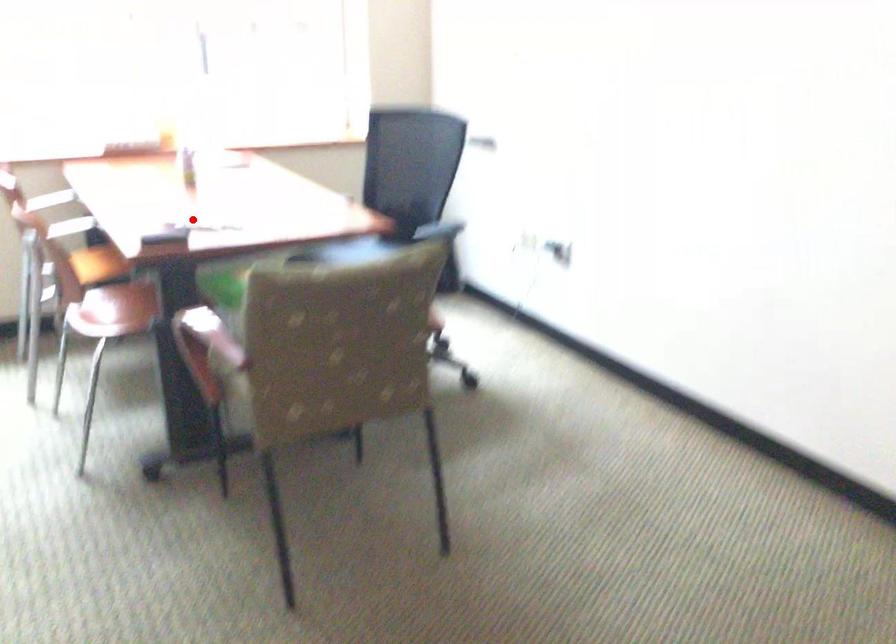
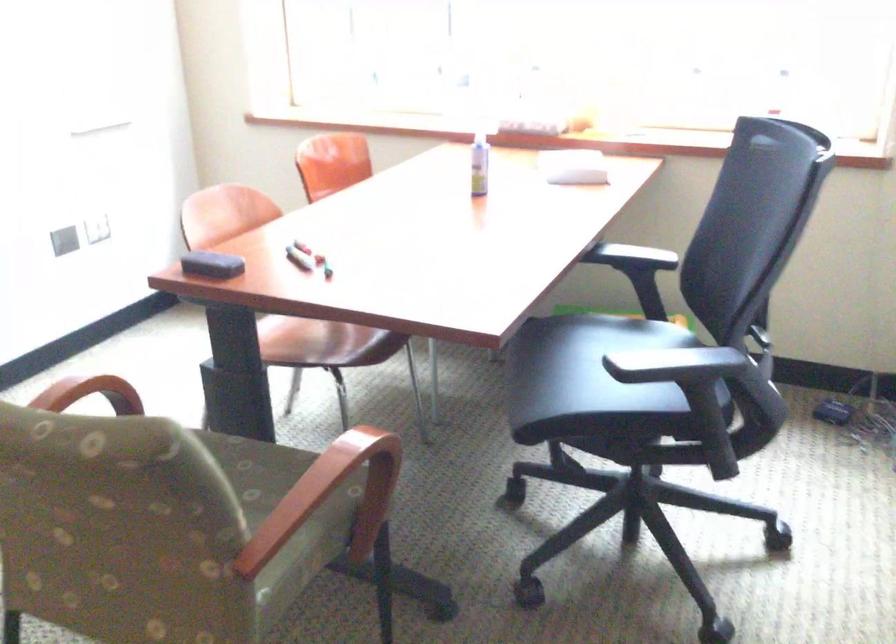
Question: I am providing you with two images of the same scene from different viewpoints. A red point is shown in image1. For the corresponding object point in image2, is it positioned nearer or farther from the camera?

Choices:
 (A) Nearer
 (B) Farther

Answer: (A)